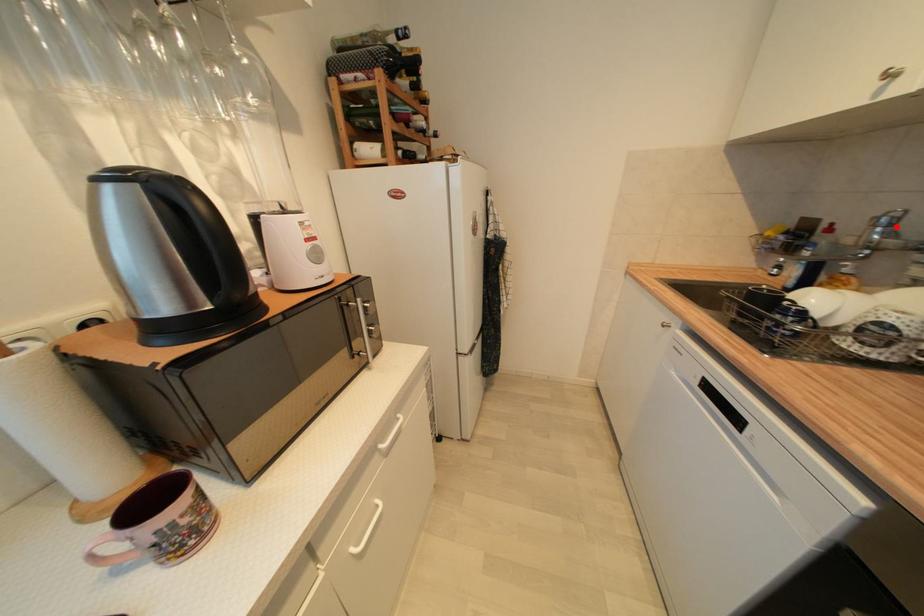
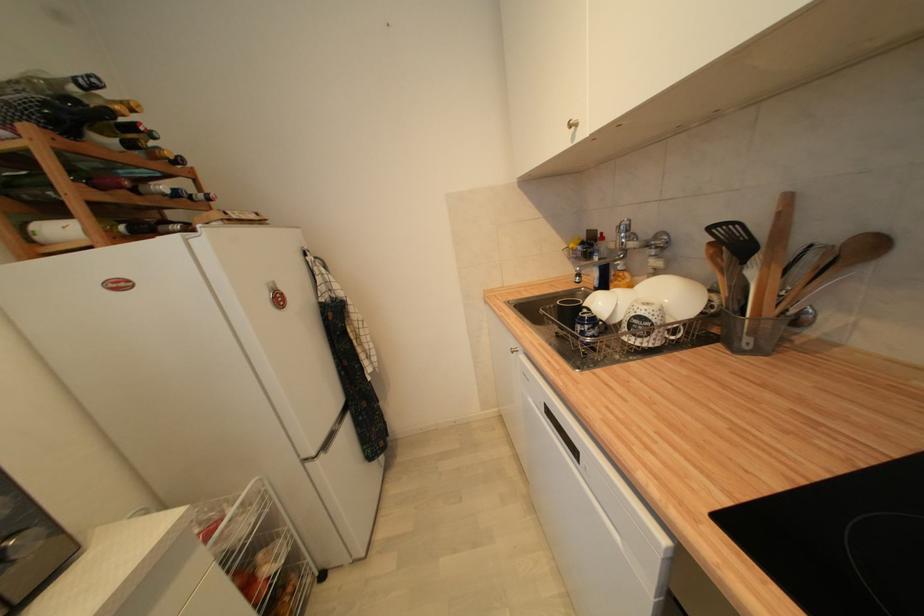
In the second image, find the point that corresponds to the highlighted location in the first image.

(633, 233)